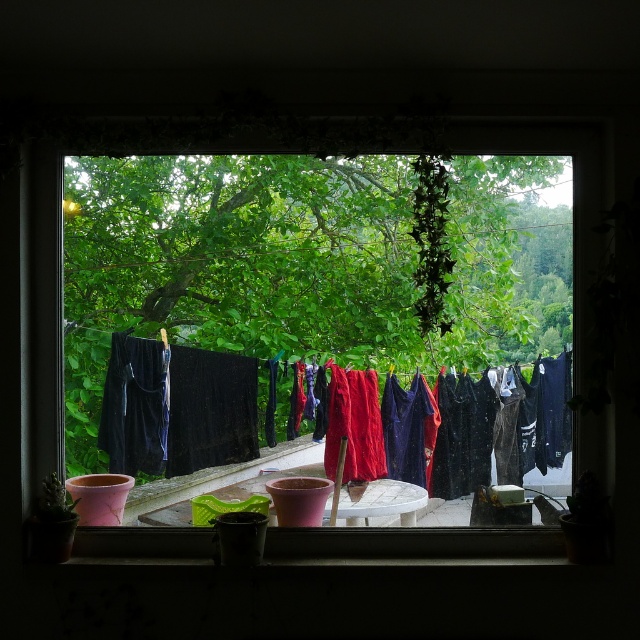
Question: Can you confirm if transparent glass window at center is positioned above red fabric laundry at center?

Choices:
 (A) yes
 (B) no

Answer: (A)

Question: Can you confirm if transparent glass window at center is bigger than red fabric laundry at center?

Choices:
 (A) yes
 (B) no

Answer: (A)

Question: Does transparent glass window at center have a greater width compared to red fabric laundry at center?

Choices:
 (A) no
 (B) yes

Answer: (B)